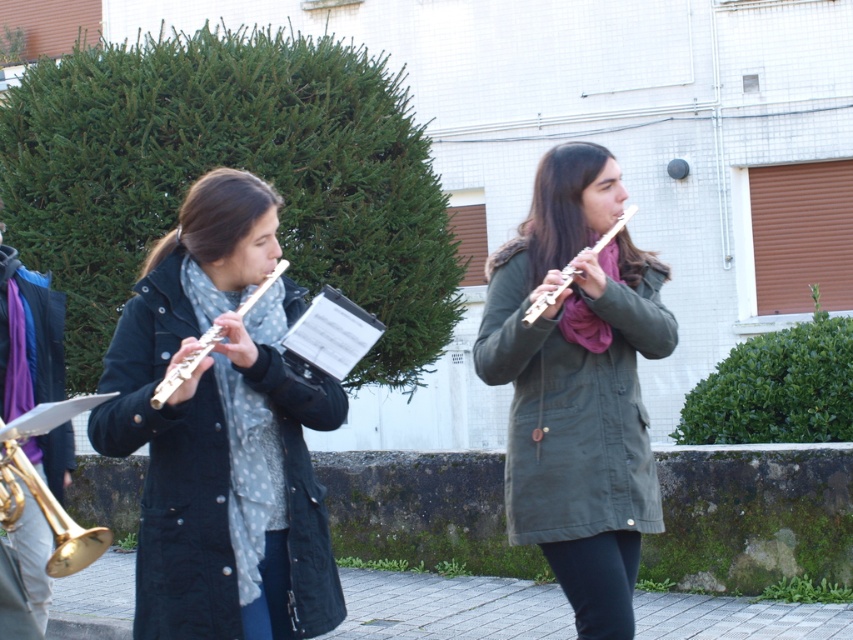
Question: Which of the following is the farthest from the observer?

Choices:
 (A) paved stone pavement at lower center
 (B) metallic silver flute at center
 (C) matte silver flute at center

Answer: (A)

Question: Does gold brass trumpet at lower left appear under matte silver flute at center?

Choices:
 (A) no
 (B) yes

Answer: (B)

Question: Which of the following is the farthest from the observer?

Choices:
 (A) (53, 586)
 (B) (653, 508)

Answer: (A)

Question: Based on their relative distances, which object is nearer to the matte black coat at left?

Choices:
 (A) matte olive-green coat at center
 (B) gold brass hautboy at left
 (C) matte silver flute at center

Answer: (C)

Question: Is matte black coat at left positioned before gold brass hautboy at left?

Choices:
 (A) no
 (B) yes

Answer: (B)

Question: Is gold brass trumpet at lower left bigger than metallic silver flute at center?

Choices:
 (A) no
 (B) yes

Answer: (B)